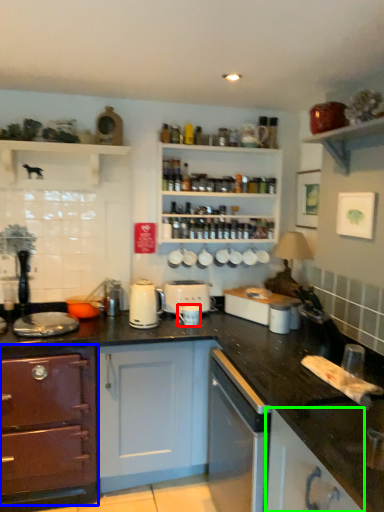
Question: Which object is positioned farthest from appliance (highlighted by a red box)? Select from cabinetry (highlighted by a blue box) and cabinetry (highlighted by a green box).

Choices:
 (A) cabinetry
 (B) cabinetry

Answer: (B)